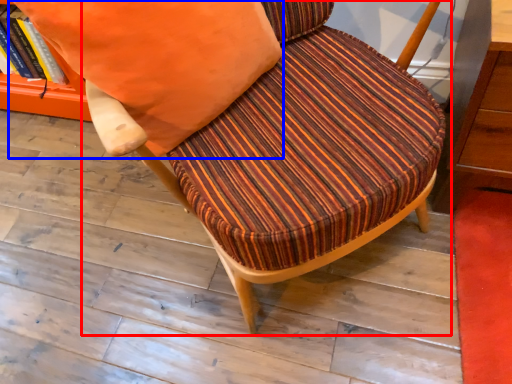
Question: Which of the following is the closest to the observer, chair (highlighted by a red box) or throw pillow (highlighted by a blue box)?

Choices:
 (A) chair
 (B) throw pillow

Answer: (A)